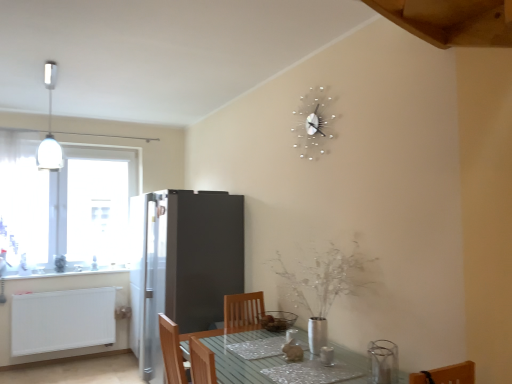
Question: Is white matte radiator at lower left directly adjacent to silver metallic clock at upper center?

Choices:
 (A) yes
 (B) no

Answer: (B)

Question: From the image's perspective, would you say white matte radiator at lower left is positioned over silver metallic clock at upper center?

Choices:
 (A) yes
 (B) no

Answer: (B)

Question: Can you confirm if white matte radiator at lower left is positioned to the left of silver metallic clock at upper center?

Choices:
 (A) yes
 (B) no

Answer: (A)

Question: Is white matte radiator at lower left oriented towards silver metallic clock at upper center?

Choices:
 (A) no
 (B) yes

Answer: (A)

Question: Is the depth of white matte radiator at lower left greater than that of silver metallic clock at upper center?

Choices:
 (A) yes
 (B) no

Answer: (A)

Question: Can you confirm if white matte radiator at lower left is thinner than silver metallic clock at upper center?

Choices:
 (A) no
 (B) yes

Answer: (A)

Question: Considering the relative sizes of silver metallic vase at center and white glossy counter top at left in the image provided, is silver metallic vase at center taller than white glossy counter top at left?

Choices:
 (A) yes
 (B) no

Answer: (A)

Question: Is white glossy counter top at left located within silver metallic vase at center?

Choices:
 (A) no
 (B) yes

Answer: (A)

Question: Does silver metallic vase at center have a larger size compared to white glossy counter top at left?

Choices:
 (A) no
 (B) yes

Answer: (B)

Question: Is silver metallic vase at center located outside white glossy counter top at left?

Choices:
 (A) no
 (B) yes

Answer: (B)

Question: Considering the relative sizes of silver metallic vase at center and white glossy counter top at left in the image provided, is silver metallic vase at center smaller than white glossy counter top at left?

Choices:
 (A) yes
 (B) no

Answer: (B)

Question: Is silver metallic vase at center at the right side of white glossy counter top at left?

Choices:
 (A) no
 (B) yes

Answer: (B)

Question: Considering the relative positions of white glossy counter top at left and wooden at upper right in the image provided, is white glossy counter top at left to the left of wooden at upper right from the viewer's perspective?

Choices:
 (A) no
 (B) yes

Answer: (B)